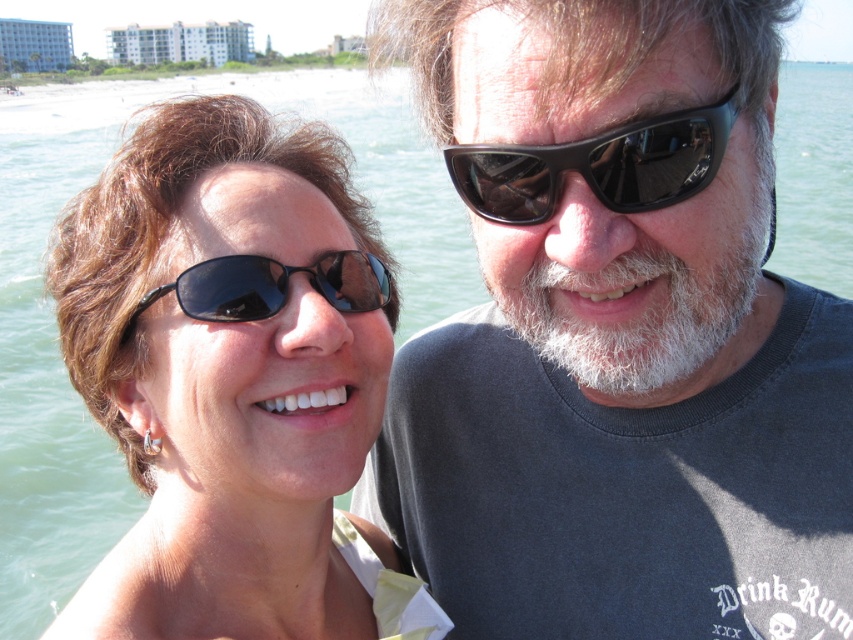
Question: Can you confirm if matte black sunglasses at upper center is positioned to the right of matte black sunglasses at left?

Choices:
 (A) no
 (B) yes

Answer: (B)

Question: Which point appears farthest from the camera in this image?

Choices:
 (A) (677, 120)
 (B) (679, 118)

Answer: (A)

Question: Can you confirm if matte black sunglasses at upper center is positioned to the left of black matte sunglasses at left?

Choices:
 (A) no
 (B) yes

Answer: (A)

Question: Which object is positioned farthest from the black shiny sunglasses at upper right?

Choices:
 (A) matte black sunglasses at left
 (B) matte black sunglasses at upper center
 (C) black matte sunglasses at left

Answer: (A)

Question: Is the position of matte black sunglasses at left more distant than that of black matte sunglasses at left?

Choices:
 (A) no
 (B) yes

Answer: (B)

Question: Which object is positioned farthest from the black shiny sunglasses at upper right?

Choices:
 (A) black matte sunglasses at left
 (B) matte black sunglasses at upper center

Answer: (A)